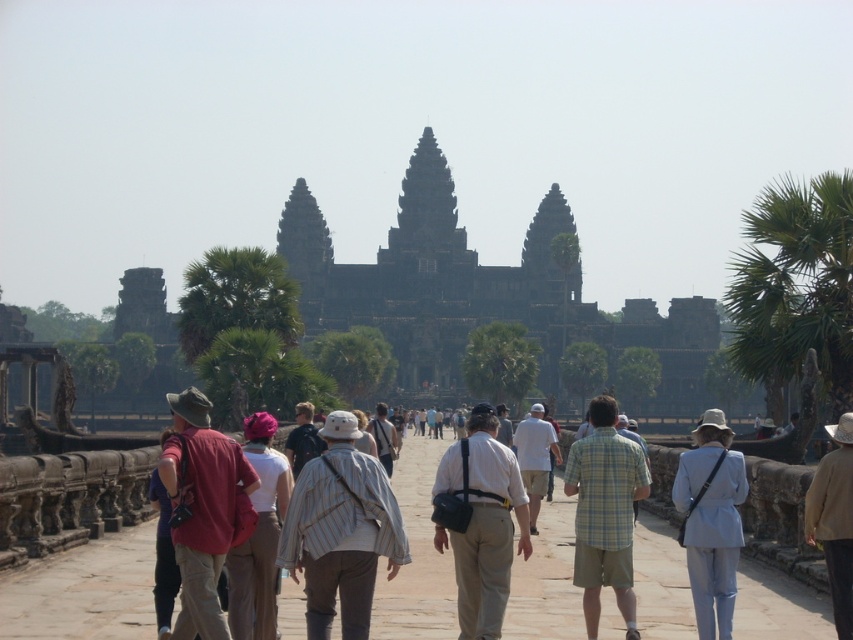
Question: Which object is the closest to the light beige cotton pants at center?

Choices:
 (A) matte red shirt at center
 (B) dark stone temple at center

Answer: (A)

Question: Which point is farther to the camera?

Choices:
 (A) (604, 556)
 (B) (843, 472)

Answer: (B)

Question: Based on their relative distances, which object is farther from the light blue fabric coat at center-right?

Choices:
 (A) brown stone pathway at center
 (B) matte red shirt at center
 (C) dark blue backpack at center
 (D) khaki pants at center

Answer: (C)

Question: In this image, where is matte red shirt at center located relative to striped shirt at center?

Choices:
 (A) left
 (B) right

Answer: (A)

Question: Does light green plaid shirt at center come in front of white cotton shirt at center?

Choices:
 (A) yes
 (B) no

Answer: (A)

Question: Where is light green plaid shirt at center located in relation to white cotton shirt at center in the image?

Choices:
 (A) below
 (B) above

Answer: (A)